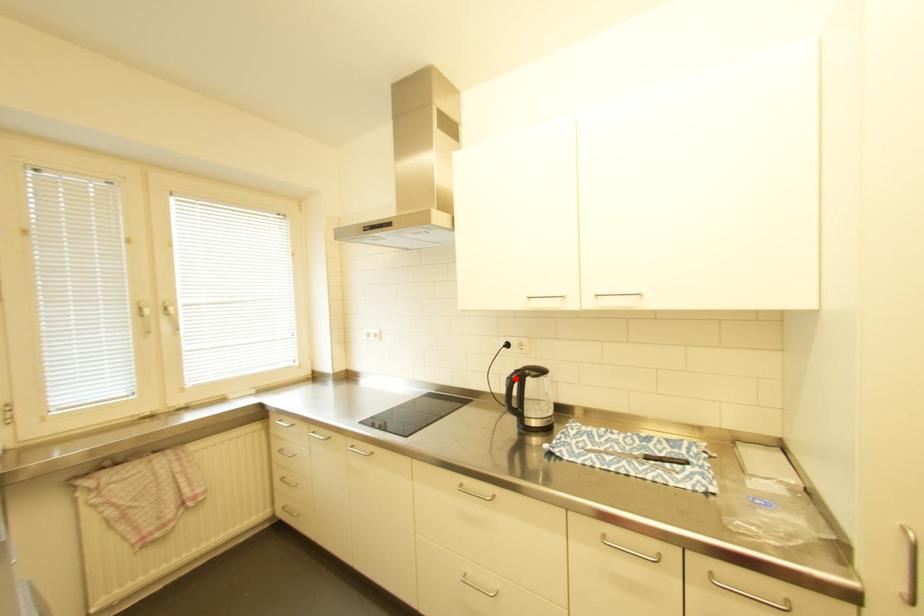
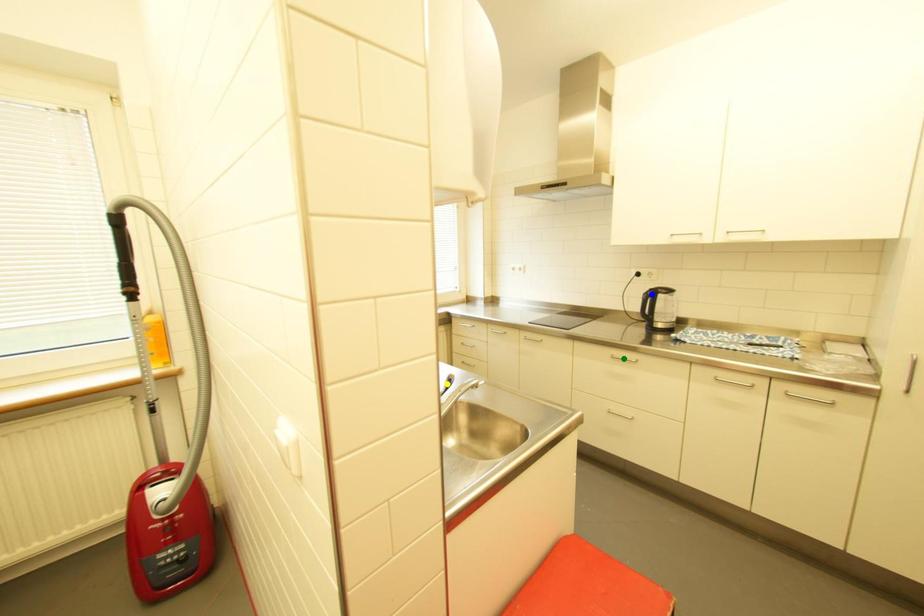
Question: I am providing you with two images of the same scene from different viewpoints. A red point is marked on the first image. You are given multiple points on the second image. Can you choose the point in image 2 that corresponds to the point in image 1?

Choices:
 (A) yellow point
 (B) blue point
 (C) green point

Answer: (B)